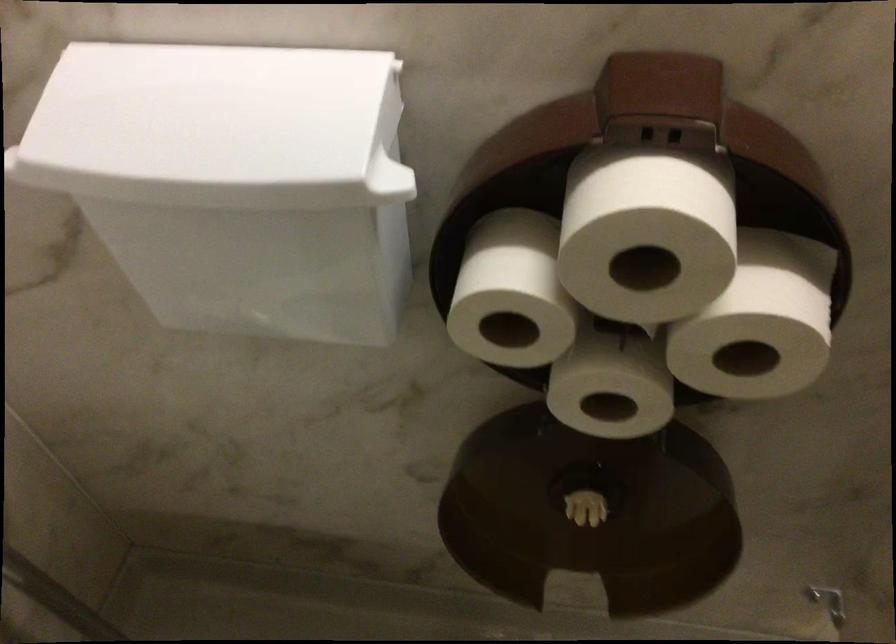
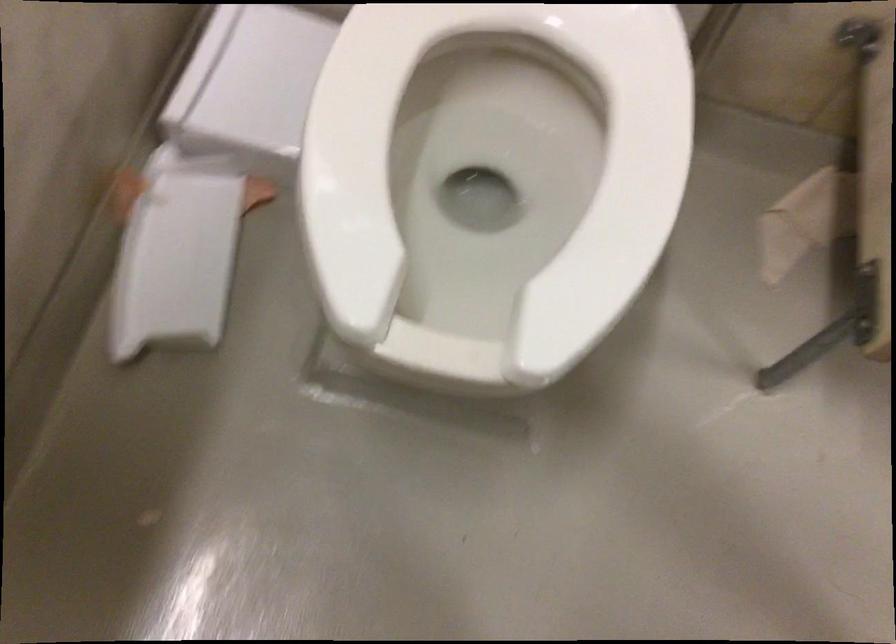
How did the camera likely rotate?

The camera's rotation is toward right-down.